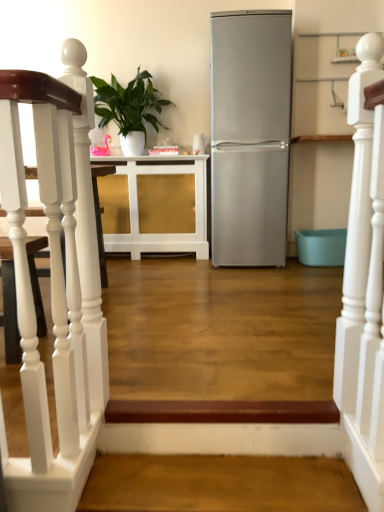
Question: Is white wooden railing at upper right wider or thinner than white glossy cabinet at center?

Choices:
 (A) wide
 (B) thin

Answer: (B)

Question: Choose the correct answer: Is white wooden railing at upper right inside white glossy cabinet at center or outside it?

Choices:
 (A) outside
 (B) inside

Answer: (A)

Question: Estimate the real-world distances between objects in this image. Which object is closer to the satin silver refrigerator at center?

Choices:
 (A) green glossy plant at upper center
 (B) brown wood stairwell at lower center, the first stairwell positioned from the bottom
 (C) white wooden railing at upper right
 (D) white glossy cabinet at center
 (E) white wooden staircase at left, placed as the second stairwell when sorted from bottom to top

Answer: (D)

Question: Which is nearer to the satin silver refrigerator at center?

Choices:
 (A) green glossy plant at upper center
 (B) white glossy cabinet at center
 (C) white wooden staircase at left, placed as the second stairwell when sorted from bottom to top
 (D) brown wood stairwell at lower center, the first stairwell positioned from the bottom
 (E) white wooden railing at upper right

Answer: (B)